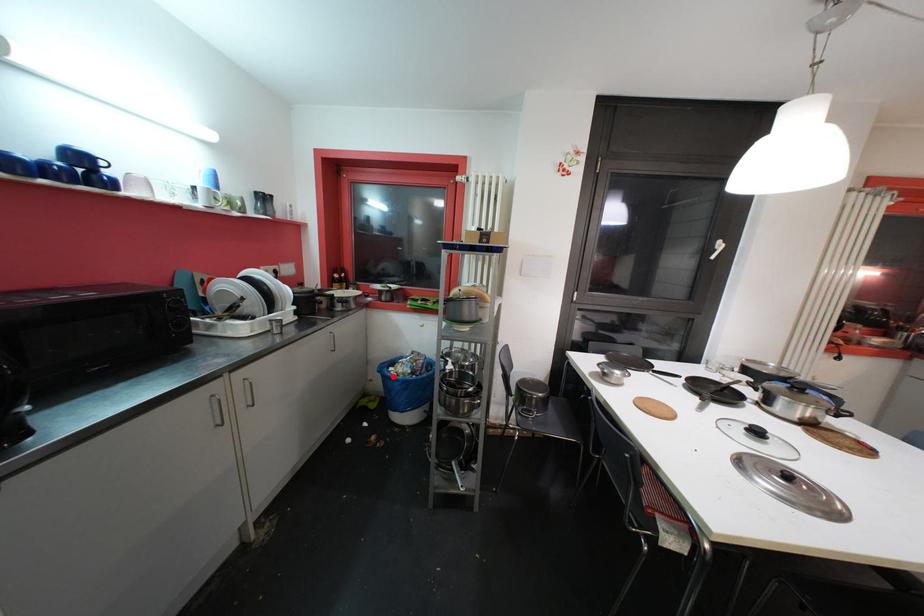
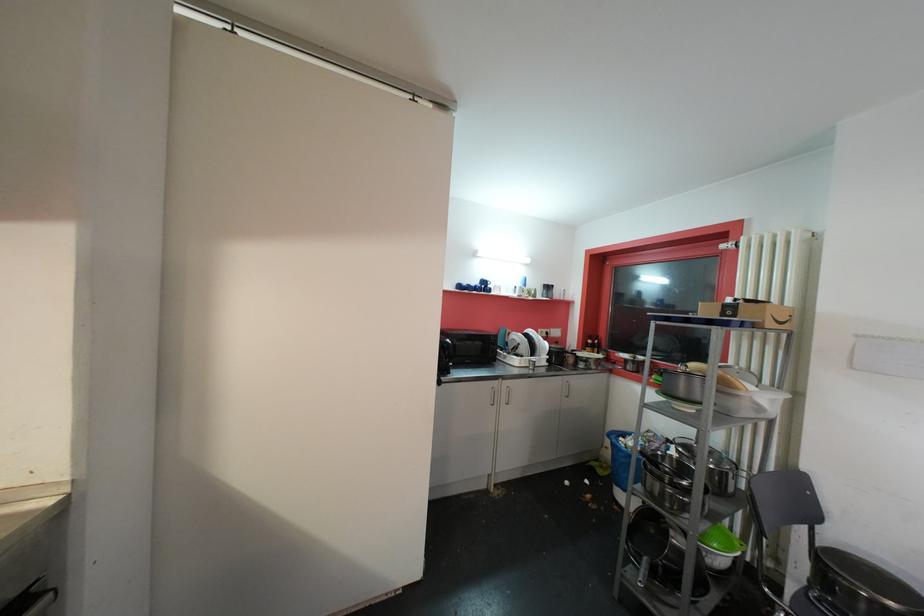
Question: I am providing you with two images of the same scene from different viewpoints. A red point is marked on the first image. At the location where the point appears in image 1, is it still visible in image 2?

Choices:
 (A) Yes
 (B) No

Answer: (A)